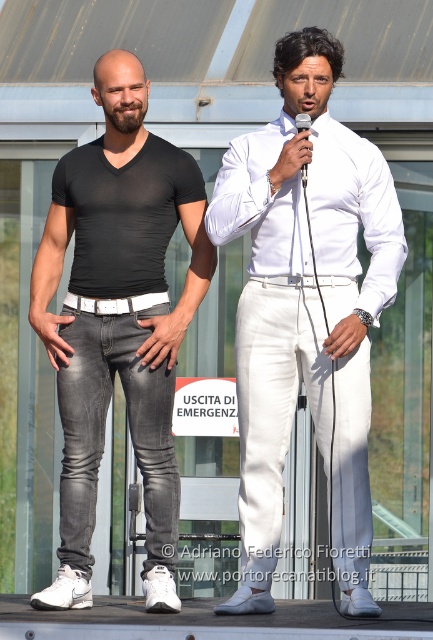
Question: Considering the real-world distances, which object is closest to the white leather belt at center?

Choices:
 (A) white satin shirt at center
 (B) dark gray denim jeans at left

Answer: (B)

Question: Can you confirm if white leather belt at center is thinner than metallic silver microphone at center?

Choices:
 (A) no
 (B) yes

Answer: (A)

Question: Can you confirm if dark gray denim jeans at left is positioned below metallic silver microphone at center?

Choices:
 (A) yes
 (B) no

Answer: (A)

Question: Which object appears closest to the camera in this image?

Choices:
 (A) white leather belt at center
 (B) white satin shirt at center
 (C) matte black t-shirt at center
 (D) white linen pants at center

Answer: (D)

Question: Which of the following is the closest to the observer?

Choices:
 (A) white linen pants at center
 (B) white leather belt at center

Answer: (A)

Question: Does matte black t-shirt at center have a smaller size compared to dark gray denim jeans at left?

Choices:
 (A) yes
 (B) no

Answer: (B)